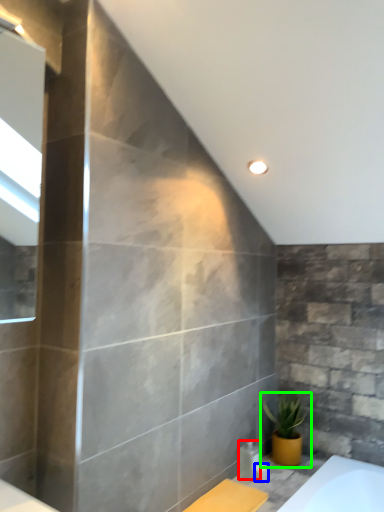
Question: Which object is positioned farthest from toiletry (highlighted by a red box)? Select from toiletry (highlighted by a blue box) and houseplant (highlighted by a green box).

Choices:
 (A) toiletry
 (B) houseplant

Answer: (B)